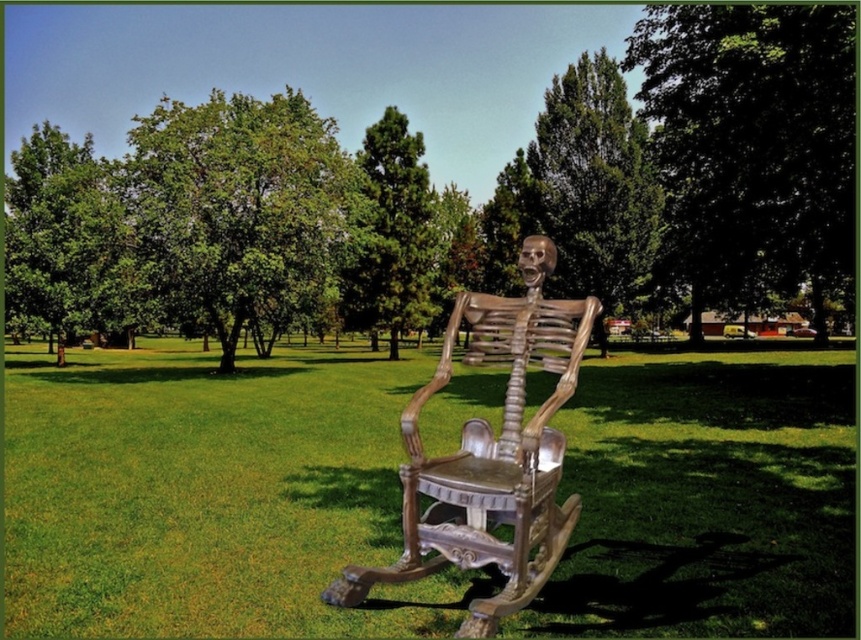
Question: Which object is closer to the camera taking this photo?

Choices:
 (A) green grass at center
 (B) wooden rocking chair at center

Answer: (B)

Question: Which object appears farthest from the camera in this image?

Choices:
 (A) wooden rocking chair at center
 (B) green grass at center

Answer: (B)

Question: Is green grass at center positioned in front of wooden rocking chair at center?

Choices:
 (A) no
 (B) yes

Answer: (A)

Question: Can you confirm if green grass at center is smaller than wooden rocking chair at center?

Choices:
 (A) yes
 (B) no

Answer: (B)

Question: Does green grass at center appear on the right side of wooden rocking chair at center?

Choices:
 (A) yes
 (B) no

Answer: (A)